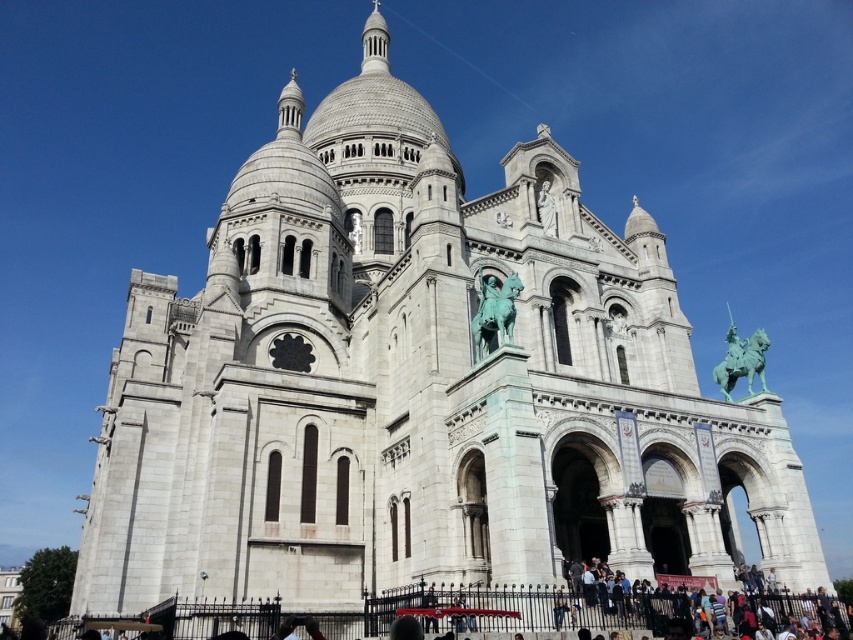
Is green patina bronze statue at center wider than white stone statue at upper center?

Indeed, green patina bronze statue at center has a greater width compared to white stone statue at upper center.

Which is behind, point (502, 300) or point (555, 221)?

Positioned behind is point (555, 221).

Find the location of a particular element. green patina bronze statue at center is located at coordinates coord(492,314).

What do you see at coordinates (741, 358) in the screenshot?
I see `green patina horseman at upper right` at bounding box center [741, 358].

Is green patina horseman at upper right smaller than white stone statue at upper center?

No, green patina horseman at upper right is not smaller than white stone statue at upper center.

Does point (729, 330) come closer to viewer compared to point (548, 195)?

No.

You are a GUI agent. You are given a task and a screenshot of the screen. Output one action in this format:
    pyautogui.click(x=<x>, y=<y>)
    Task: Click on the green patina horseman at upper right
    This screenshot has width=853, height=640.
    Given the screenshot: What is the action you would take?
    pyautogui.click(x=741, y=358)

Is point (752, 340) closer to viewer compared to point (352, 248)?

That is True.

Is point (715, 376) positioned before point (347, 230)?

Yes, it is.

The height and width of the screenshot is (640, 853). What are the coordinates of `green patina horseman at upper right` in the screenshot? It's located at (741, 358).